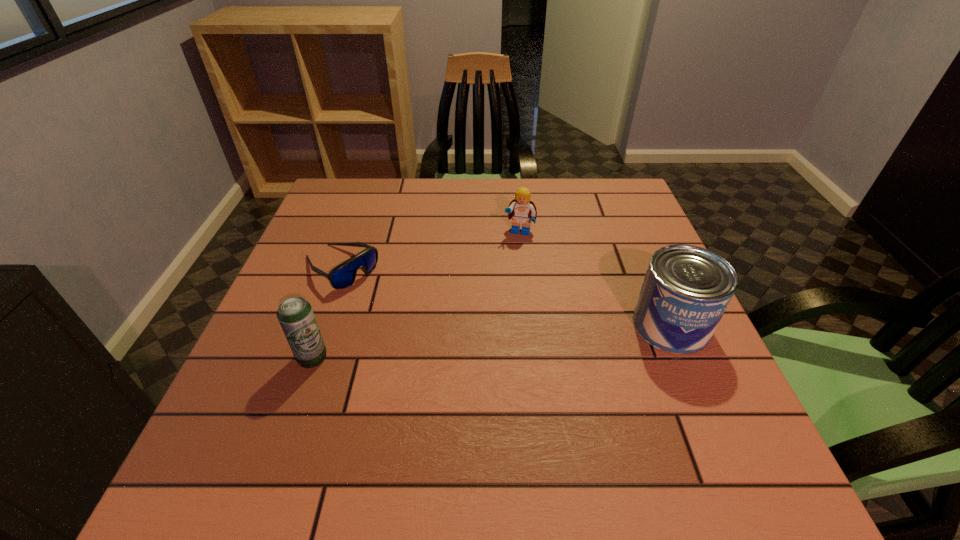
You are a GUI agent. You are given a task and a screenshot of the screen. Output one action in this format:
    pyautogui.click(x=<x>, y=<y>)
    Task: Click on the beer can
    Image resolution: width=960 pixels, height=540 pixels.
    Given the screenshot: What is the action you would take?
    click(295, 315)

Where is `the rightmost object`? The image size is (960, 540). the rightmost object is located at coordinates (686, 290).

The height and width of the screenshot is (540, 960). I want to click on the farthest object, so click(521, 210).

The width and height of the screenshot is (960, 540). In order to click on the second object from right to left in this screenshot , I will do `click(521, 210)`.

Identify the location of sunglasses. Image resolution: width=960 pixels, height=540 pixels. (342, 276).

Find the location of a particular element. the shortest object is located at coordinates (342, 276).

The width and height of the screenshot is (960, 540). In order to click on vacant space located on the right of the beer can in this screenshot , I will do coord(368,357).

Where is `free space located 0.190m on the front-facing side of the Lego`? The width and height of the screenshot is (960, 540). free space located 0.190m on the front-facing side of the Lego is located at coordinates pos(504,288).

The height and width of the screenshot is (540, 960). What are the coordinates of `free region located 0.110m on the front-facing side of the Lego` in the screenshot? It's located at (510, 266).

Identify the location of vacant space located on the front-facing side of the Lego. tap(493, 329).